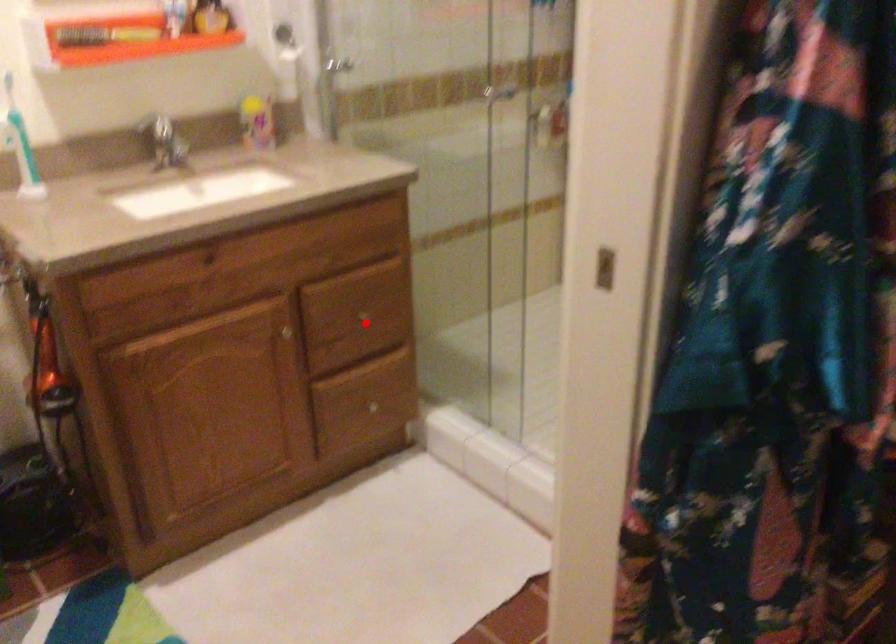
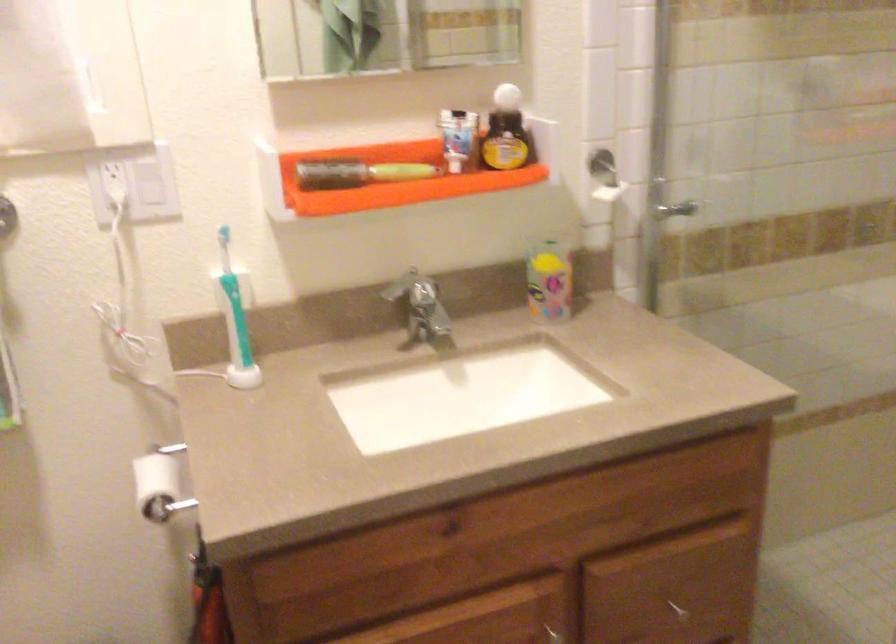
In the second image, find the point that corresponds to the highlighted location in the first image.

(677, 609)